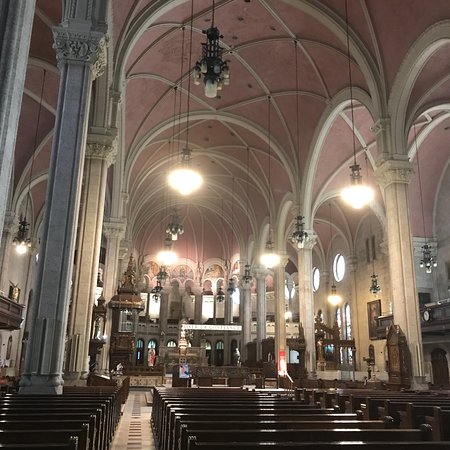
Where is `ceiling arches`? Image resolution: width=450 pixels, height=450 pixels. ceiling arches is located at coordinates (140, 168), (221, 185), (219, 207), (41, 181), (323, 179), (325, 216), (249, 168).